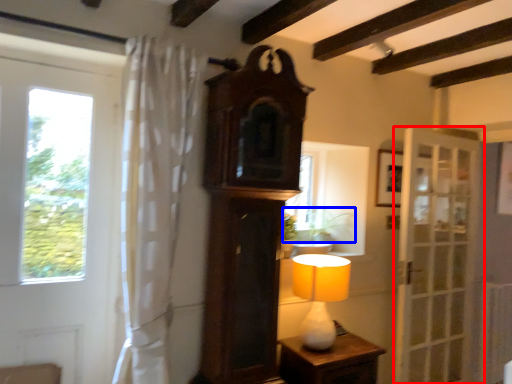
Question: Which object is further to the camera taking this photo, door (highlighted by a red box) or plant (highlighted by a blue box)?

Choices:
 (A) door
 (B) plant

Answer: (A)